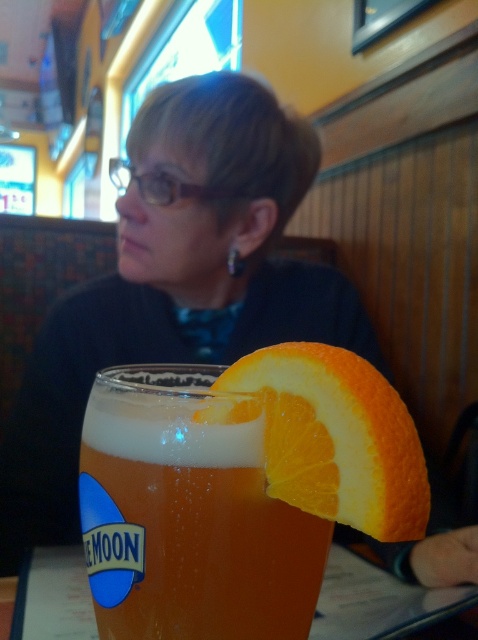
You are a bartender who needs to place an orange slice on the rim of the translucent glass beer at center. Based on the current arrangement, where should you position the orangesmoothslice at right relative to the glass?

The translucent glass beer at center is positioned under orangesmoothslice at right, so you should move the orangesmoothslice at right to the rim of the translucent glass beer at center.

You are a waiter in a restaurant and need to place a small coaster under the glass beer at center. The coaster has a radius of 3 cm. The point at coordinate (188,516) is on the glass beer. Can you determine if the coaster will fit under the glass beer at center without touching the edges?

The point at coordinate (188,516) is on the translucent glass beer at center, so the coaster with a radius of 3 cm will fit under the glass beer at center as long as the coaster is placed centrally and the glass is stable.